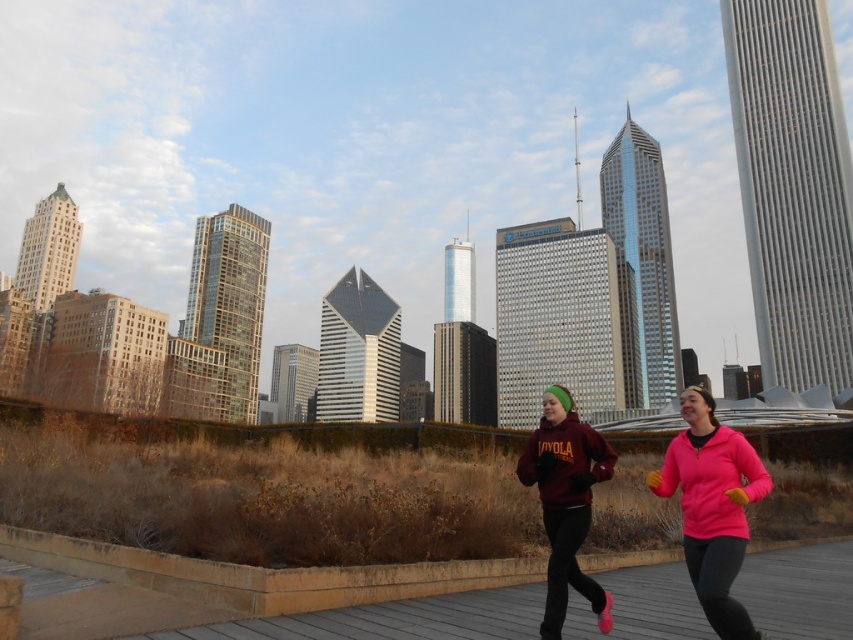
Does wooden deck at center appear on the right side of maroon fleece jacket at center?

In fact, wooden deck at center is to the left of maroon fleece jacket at center.

Which is in front, point (485, 602) or point (561, 413)?

Point (561, 413) is more forward.

You are a GUI agent. You are given a task and a screenshot of the screen. Output one action in this format:
    pyautogui.click(x=<x>, y=<y>)
    Task: Click on the wooden deck at center
    
    Given the screenshot: What is the action you would take?
    pyautogui.click(x=434, y=609)

Between pink fleece at center and maroon fleece jacket at center, which one appears on the right side from the viewer's perspective?

Positioned to the right is pink fleece at center.

Is point (685, 467) more distant than point (520, 460)?

That is False.

The height and width of the screenshot is (640, 853). What are the coordinates of `pink fleece at center` in the screenshot? It's located at (712, 506).

Between point (485, 579) and point (718, 532), which one is positioned in front?

Positioned in front is point (718, 532).

Identify the location of wooden deck at center. (434, 609).